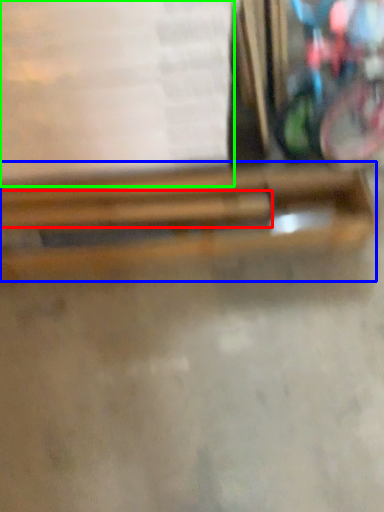
Question: Considering the real-world distances, which object is closest to wood (highlighted by a red box)? wood (highlighted by a blue box) or paperback book (highlighted by a green box).

Choices:
 (A) wood
 (B) paperback book

Answer: (A)